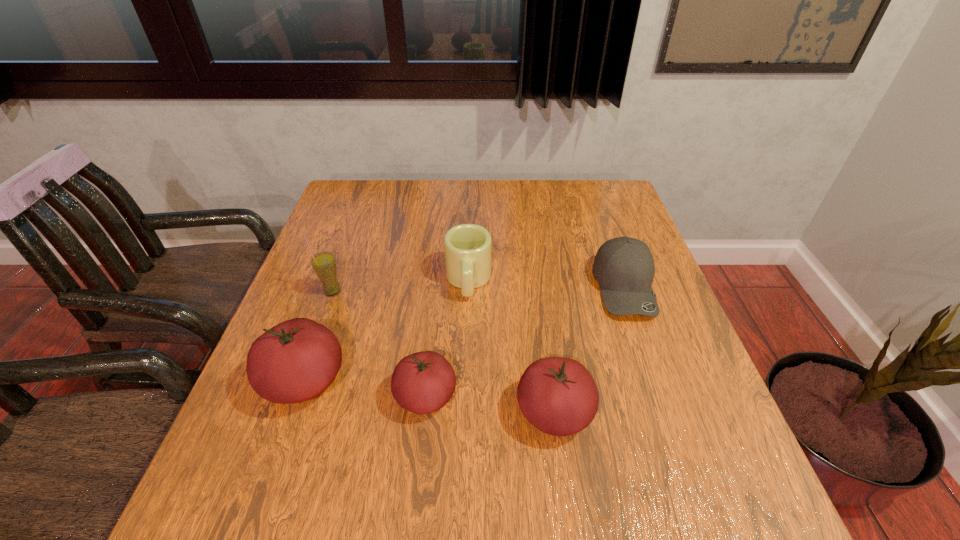
The height and width of the screenshot is (540, 960). Identify the location of free space located 0.300m on the front brim of the baseball cap. (683, 447).

The width and height of the screenshot is (960, 540). I want to click on free space located on the back of the straw for drinking, so click(x=350, y=239).

Where is `free region located with the handle on the side of the mug`? This screenshot has width=960, height=540. free region located with the handle on the side of the mug is located at coordinates (465, 421).

Where is `tomato that is at the left edge`? The width and height of the screenshot is (960, 540). tomato that is at the left edge is located at coordinates (296, 360).

Find the location of a particular element. straw for drinking present at the left edge is located at coordinates (324, 264).

Where is `object that is at the right edge`? This screenshot has width=960, height=540. object that is at the right edge is located at coordinates (624, 267).

Where is `object positioned at the near left corner`? object positioned at the near left corner is located at coordinates (296, 360).

The height and width of the screenshot is (540, 960). I want to click on free space at the far edge, so click(571, 197).

In order to click on free spot at the near edge of the desktop in this screenshot , I will do `click(498, 440)`.

Where is `vacant area at the left edge of the desktop`? vacant area at the left edge of the desktop is located at coordinates (363, 242).